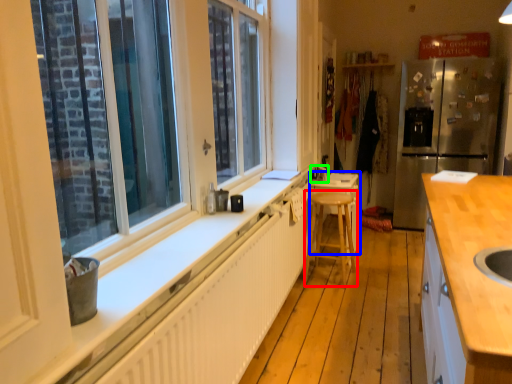
Question: Based on their relative distances, which object is nearer to bar stool (highlighted by a red box)? Choose from table (highlighted by a blue box) and faucet (highlighted by a green box).

Choices:
 (A) table
 (B) faucet

Answer: (A)